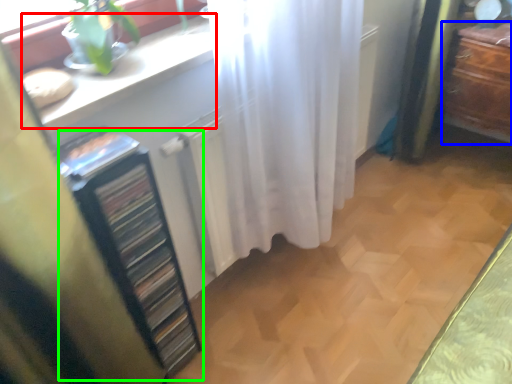
Question: Estimate the real-world distances between objects in this image. Which object is closer to counter top (highlighted by a red box), furniture (highlighted by a blue box) or file cabinet (highlighted by a green box)?

Choices:
 (A) furniture
 (B) file cabinet

Answer: (B)